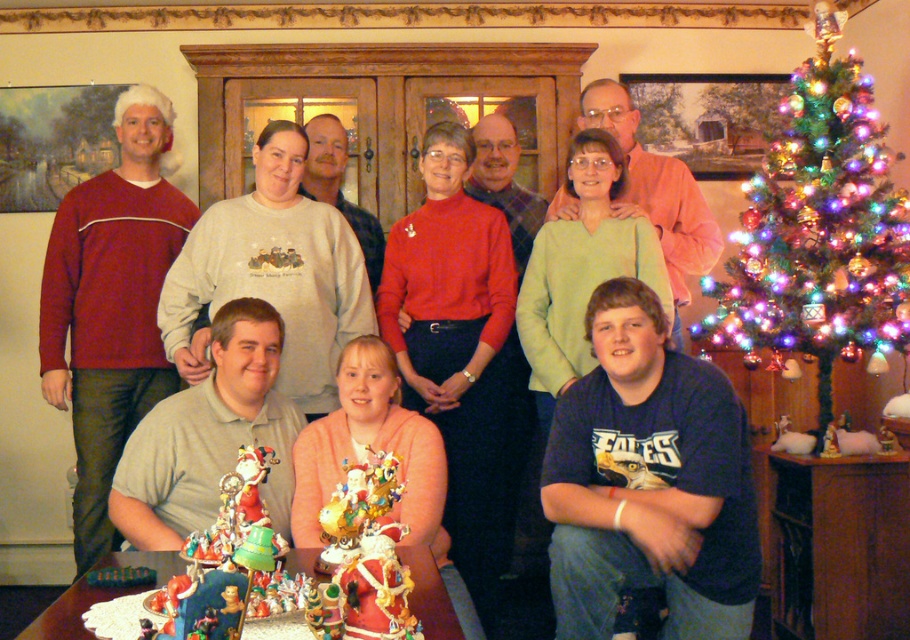
Is iridescent glass ornaments at right above matte gray sweater at center?

Indeed, iridescent glass ornaments at right is positioned over matte gray sweater at center.

Does point (875, 129) come behind point (425, 394)?

Yes, point (875, 129) is behind point (425, 394).

Which is in front, point (868, 268) or point (459, 540)?

Point (459, 540) is in front.

The height and width of the screenshot is (640, 910). What are the coordinates of `iridescent glass ornaments at right` in the screenshot? It's located at (819, 230).

Between point (703, 618) and point (88, 634), which one is positioned behind?

The point (703, 618) is more distant.

Can you confirm if dark blue t-shirt at center is positioned below wooden table at center?

No.

Is point (654, 518) positioned before point (435, 604)?

No, (654, 518) is further to viewer.

This screenshot has width=910, height=640. I want to click on dark blue t-shirt at center, so click(x=648, y=481).

Can you confirm if wooden at lower right is thinner than wooden table at center?

Indeed, wooden at lower right has a lesser width compared to wooden table at center.

Is point (805, 472) positioned in front of point (453, 614)?

That is False.

Identify the location of wooden at lower right. Image resolution: width=910 pixels, height=640 pixels. (835, 545).